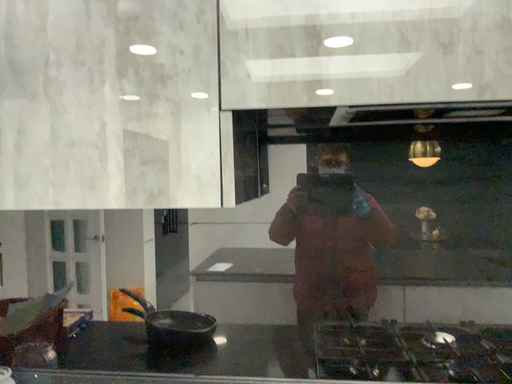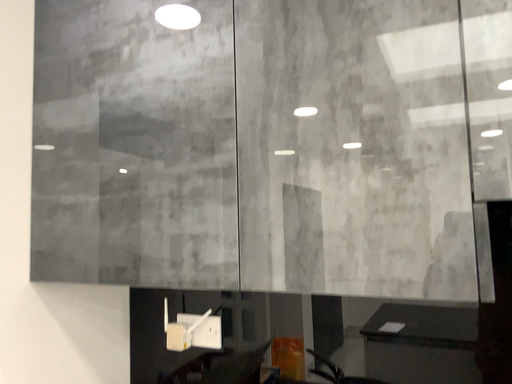
Question: How did the camera likely rotate when shooting the video?

Choices:
 (A) rotated right
 (B) rotated left

Answer: (B)